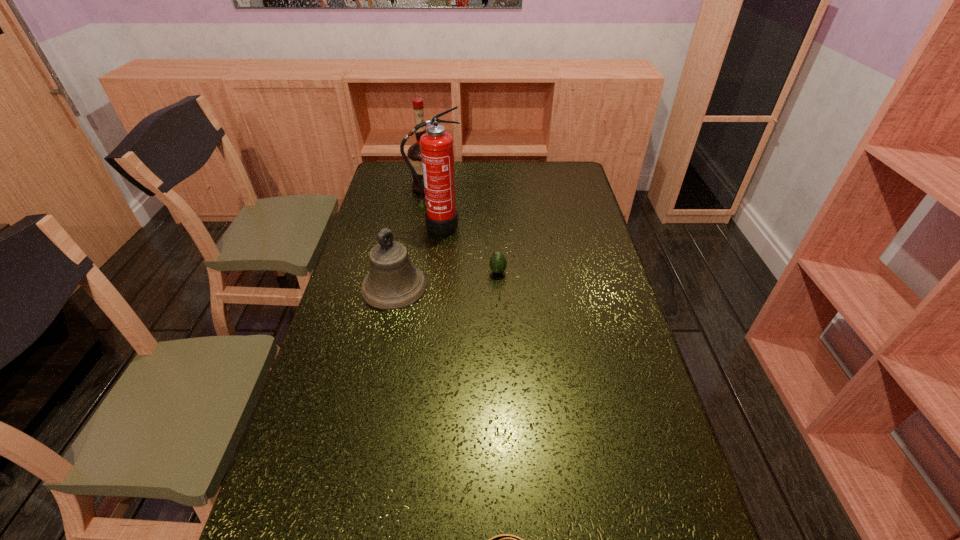
Locate an element on the screen. object that can be found as the third closest to the second farthest object is located at coordinates (497, 263).

Find the location of a particular element. vacant space that satisfies the following two spatial constraints: 1. on the front-facing side of the fire extinguisher; 2. on the left side of the avocado is located at coordinates (430, 272).

The width and height of the screenshot is (960, 540). Find the location of `vacant area in the image that satisfies the following two spatial constraints: 1. on the front and back of the farthest object; 2. on the left side of the avocado`. vacant area in the image that satisfies the following two spatial constraints: 1. on the front and back of the farthest object; 2. on the left side of the avocado is located at coordinates click(411, 272).

This screenshot has height=540, width=960. Identify the location of free space that satisfies the following two spatial constraints: 1. on the front-facing side of the fire extinguisher; 2. on the right side of the avocado. (430, 272).

Locate an element on the screen. This screenshot has width=960, height=540. free space that satisfies the following two spatial constraints: 1. on the front-facing side of the fire extinguisher; 2. on the left side of the avocado is located at coordinates (430, 272).